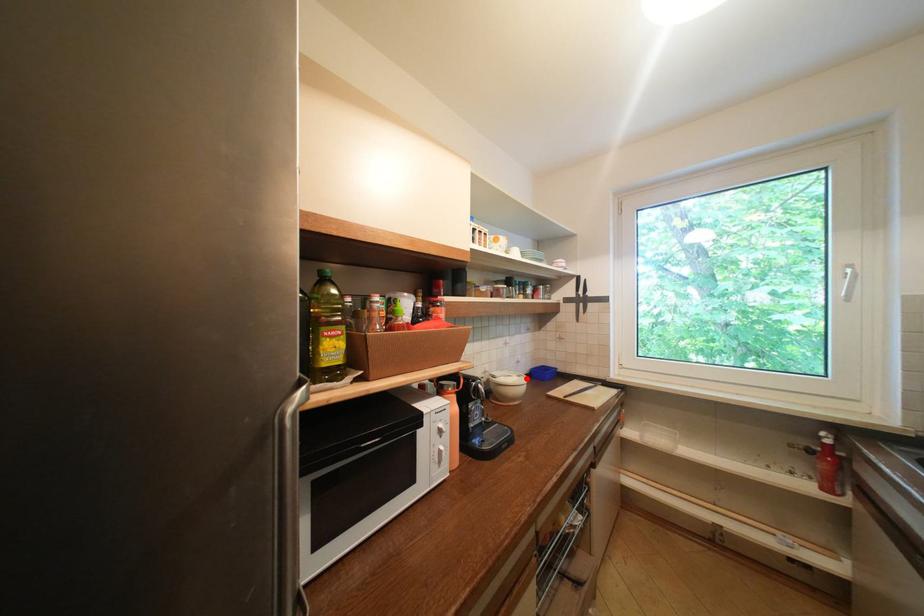
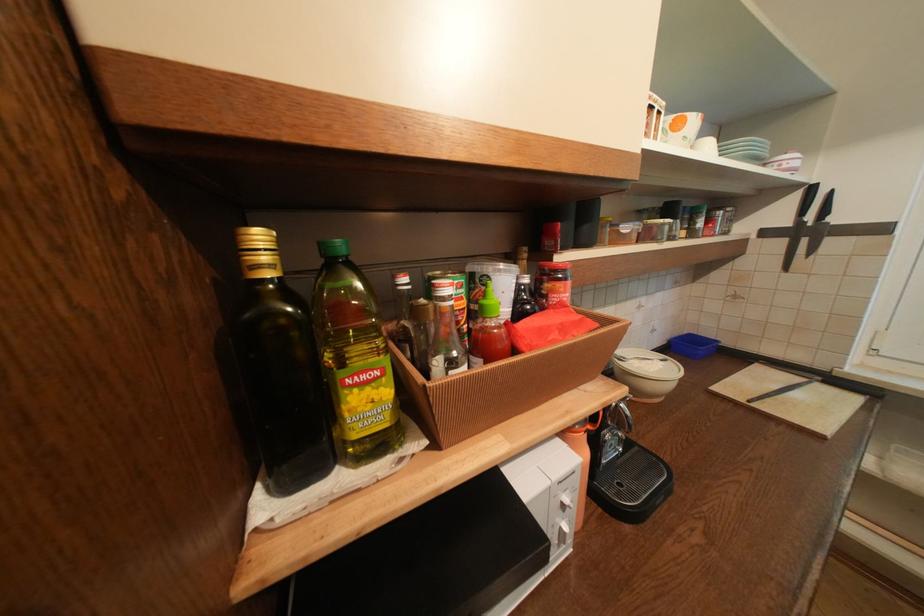
Find the pixel in the second image that matches the highlighted location in the first image.

(670, 363)